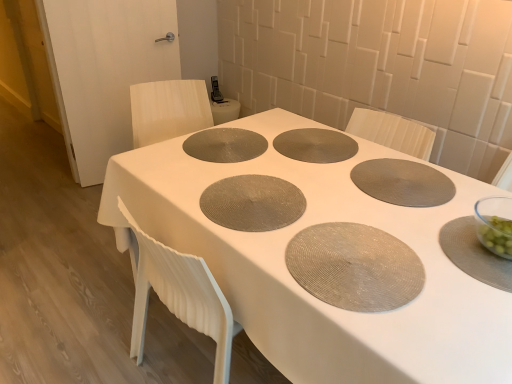
The height and width of the screenshot is (384, 512). Identify the location of free location in front of matte gray placemat at center, the second oval when ordered from left to right. (385, 323).